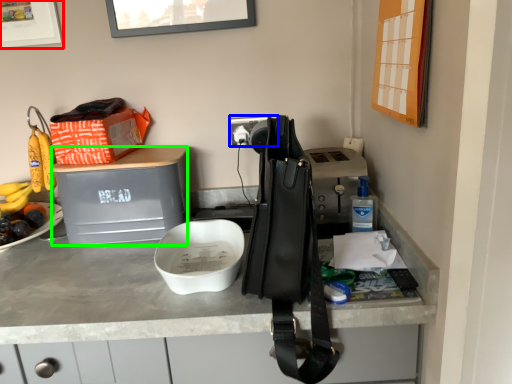
Question: Which is farther away from picture frame (highlighted by a red box)? power outlet (highlighted by a blue box) or wide (highlighted by a green box)?

Choices:
 (A) power outlet
 (B) wide

Answer: (A)